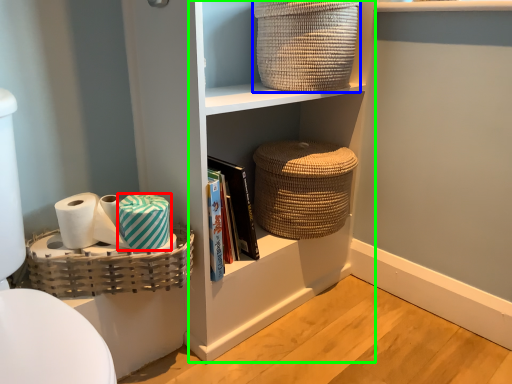
Question: Which object is positioned farthest from material (highlighted by a red box)? Select from basket (highlighted by a blue box) and cabinet (highlighted by a green box).

Choices:
 (A) basket
 (B) cabinet

Answer: (A)